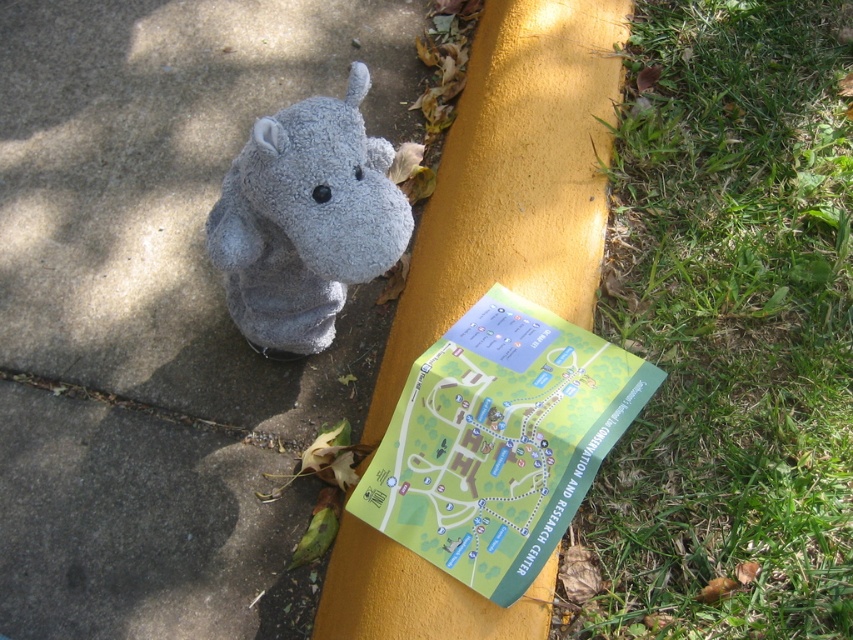
Is point (271, 420) closer to viewer compared to point (296, 348)?

No, it is behind (296, 348).

How far apart are gray fabric hippo at center and soft gray plush hippo at center?

17.56 inches

I want to click on gray fabric hippo at center, so click(161, 312).

Identify the location of gray fabric hippo at center. (161, 312).

Find the location of `yellow painted curb at upper center`. yellow painted curb at upper center is located at coordinates (514, 179).

Can you confirm if yellow painted curb at upper center is wider than green paper map at center?

Yes, yellow painted curb at upper center is wider than green paper map at center.

Which is in front, point (386, 556) or point (421, 547)?

Point (421, 547) is more forward.

You are a GUI agent. You are given a task and a screenshot of the screen. Output one action in this format:
    pyautogui.click(x=<x>, y=<y>)
    Task: Click on the yellow painted curb at upper center
    This screenshot has height=640, width=853.
    Given the screenshot: What is the action you would take?
    pyautogui.click(x=514, y=179)

Which is more to the right, yellow painted curb at upper center or soft gray plush hippo at center?

Positioned to the right is yellow painted curb at upper center.

Between yellow painted curb at upper center and soft gray plush hippo at center, which one appears on the left side from the viewer's perspective?

Positioned to the left is soft gray plush hippo at center.

Identify the location of yellow painted curb at upper center. This screenshot has height=640, width=853. (514, 179).

The height and width of the screenshot is (640, 853). Identify the location of yellow painted curb at upper center. (514, 179).